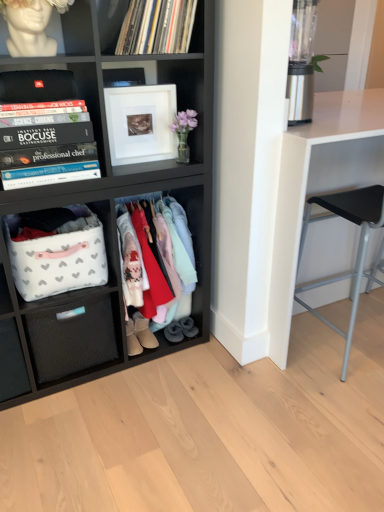
Question: From a real-world perspective, is white fabric basket at lower left above or below black woven drawer at lower left?

Choices:
 (A) above
 (B) below

Answer: (A)

Question: Based on their positions, is white fabric basket at lower left located to the left or right of black woven drawer at lower left?

Choices:
 (A) right
 (B) left

Answer: (B)

Question: Considering the real-world distances, which object is farthest from the pastel cotton clothes at center?

Choices:
 (A) gray suede boot at lower center, the third footwear from the left
 (B) matte black storage unit at center, the first shelf in the bottom-to-top sequence
 (C) beige suede boot at lower center, marked as the third footwear in a right-to-left arrangement
 (D) black woven drawer at lower left
 (E) white fabric basket at lower left

Answer: (E)

Question: Which object is positioned farthest from the dark gray suede slippers at lower center, which is the 2th footwear from left to right?

Choices:
 (A) beige suede boot at lower center, marked as the third footwear in a right-to-left arrangement
 (B) gray suede boot at lower center, which is the first footwear in right-to-left order
 (C) matte black storage unit at center, the first shelf in the bottom-to-top sequence
 (D) matte vinyl records at upper center
 (E) black woven drawer at lower left

Answer: (D)